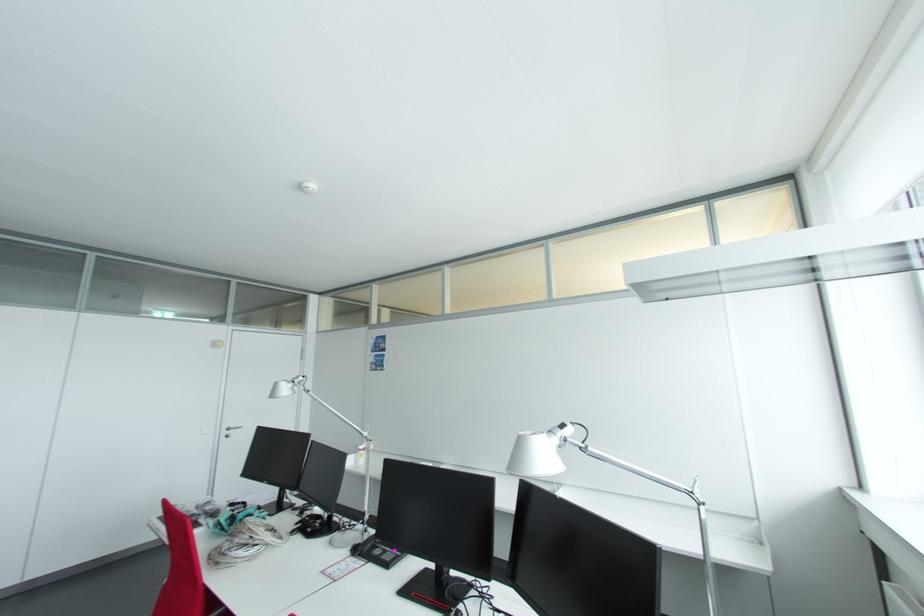
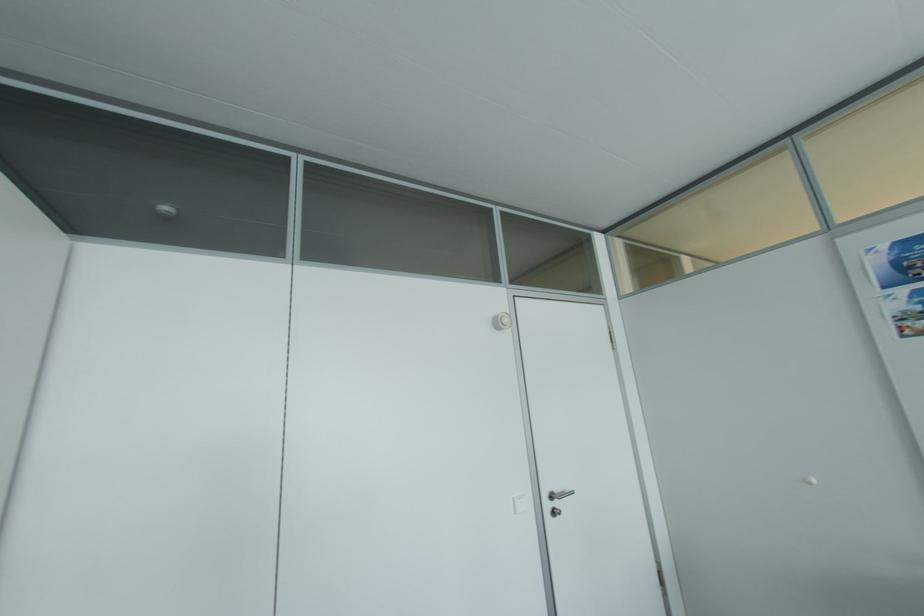
What movement of the cameraman would produce the second image?

The cameraman moved toward left, forward.